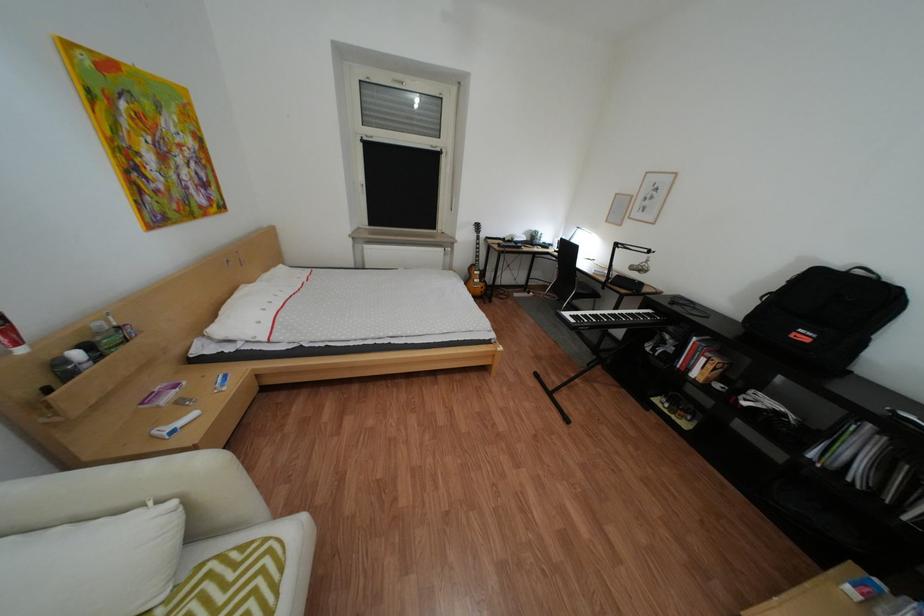
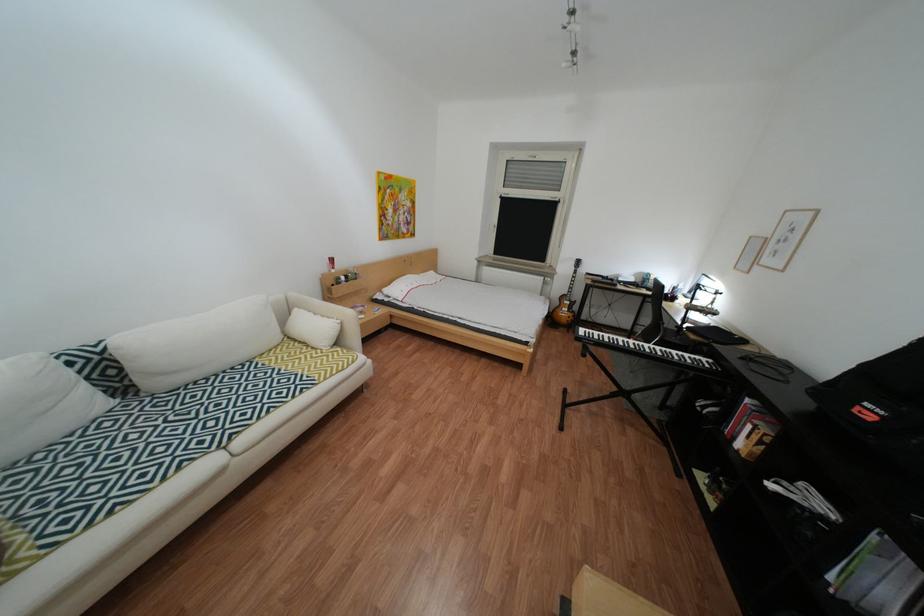
Find the pixel in the second image that matches [822,341] in the first image.

(886, 419)